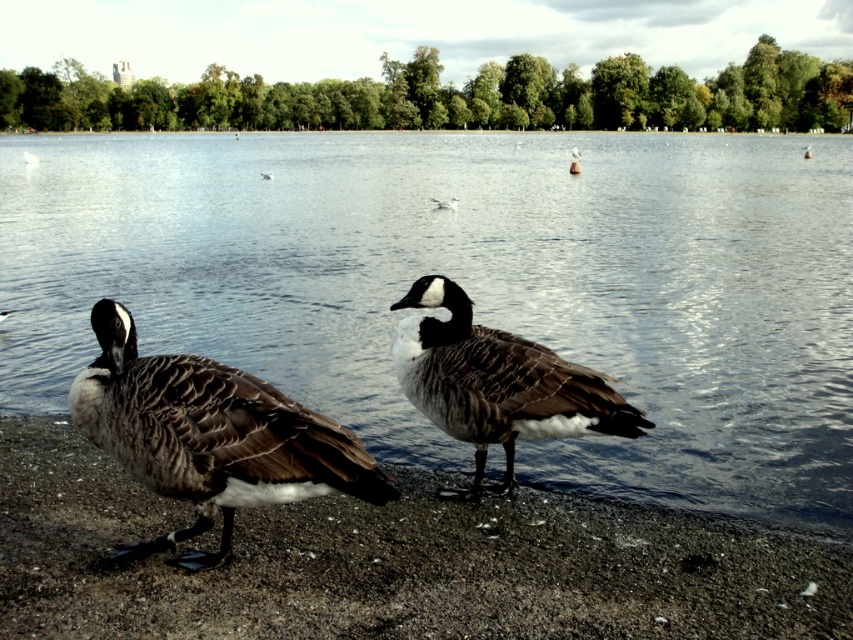
You are a birdwatcher observing the scene. You notice the smooth water at center and the dark brown feathered duck at center. Which object is positioned higher in the image?

The smooth water at center is above the dark brown feathered duck at center, so the smooth water at center is positioned higher in the image.

You are a photographer trying to capture a clear photo of the white feathered bird at center and the brown feathered goose at lower left. Since you want both birds to be in focus, which one should you focus on first to ensure the other is also in focus?

The brown feathered goose at lower left is behind the white feathered bird at center. To ensure both are in focus, you should focus on the brown feathered goose at lower left first, as it is farther away, allowing the depth of field to cover both birds.

You are a photographer trying to capture the white feathered duck at center and the smooth water at center in a single shot. Based on their positions, which object would appear closer to the camera in the photo?

The smooth water at center appears closer to the camera because it is taller than the white feathered duck at center in the scene.